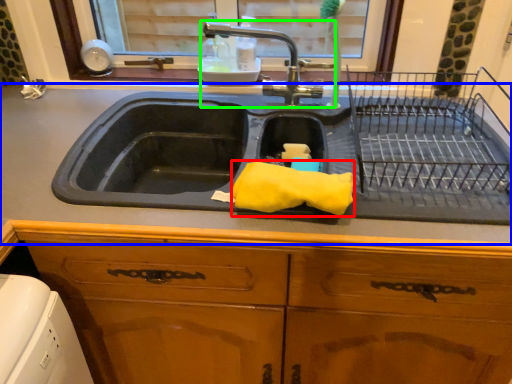
Question: Estimate the real-world distances between objects in this image. Which object is closer to material (highlighted by a red box), countertop (highlighted by a blue box) or tap (highlighted by a green box)?

Choices:
 (A) countertop
 (B) tap

Answer: (A)